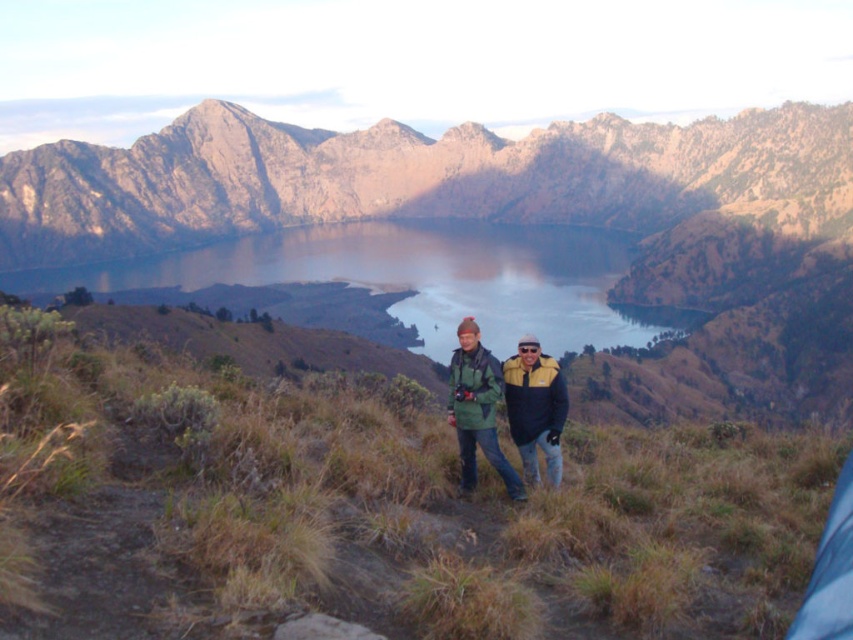
Question: Based on their relative distances, which object is farther from the green matte jacket at center?

Choices:
 (A) blue reflective water at center
 (B) brown rocky mountain at upper center

Answer: (B)

Question: Estimate the real-world distances between objects in this image. Which object is closer to the green matte jacket at center?

Choices:
 (A) brown rocky mountain at upper center
 (B) blue reflective water at center

Answer: (B)

Question: Is blue reflective water at center closer to camera compared to green matte jacket at center?

Choices:
 (A) yes
 (B) no

Answer: (B)

Question: Among these objects, which one is farthest from the camera?

Choices:
 (A) blue reflective water at center
 (B) green matte jacket at center
 (C) brown rocky mountain at upper center

Answer: (C)

Question: Does brown rocky mountain at upper center appear on the left side of green matte jacket at center?

Choices:
 (A) no
 (B) yes

Answer: (B)

Question: Does brown rocky mountain at upper center come in front of blue reflective water at center?

Choices:
 (A) no
 (B) yes

Answer: (A)